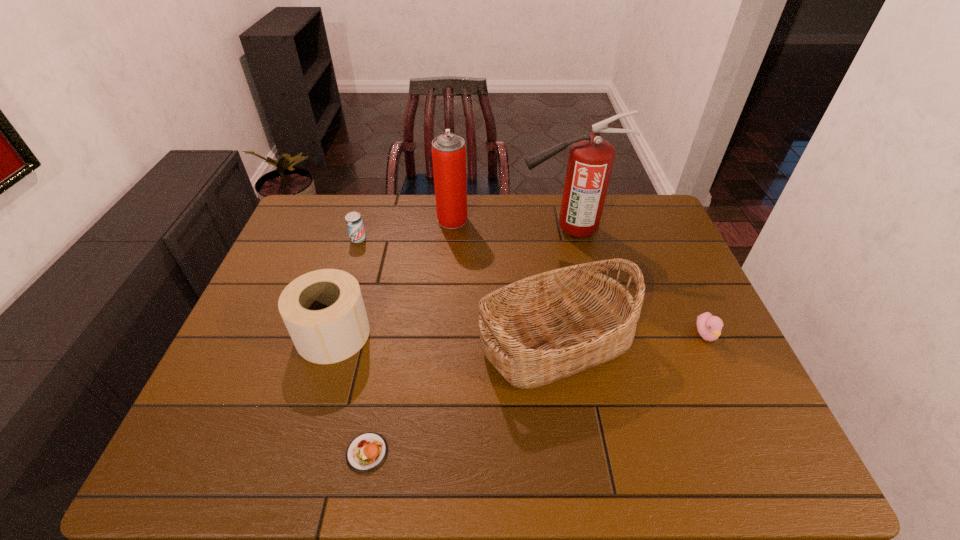
I want to click on fire extinguisher, so click(x=590, y=161).

In order to click on the fourth object from right to left in this screenshot , I will do `click(448, 150)`.

The image size is (960, 540). I want to click on the second tallest object, so click(448, 150).

Image resolution: width=960 pixels, height=540 pixels. I want to click on the fifth shortest object, so click(546, 327).

Where is `the fourth tallest object`? This screenshot has height=540, width=960. the fourth tallest object is located at coordinates (323, 310).

The width and height of the screenshot is (960, 540). I want to click on the third shortest object, so click(354, 222).

Image resolution: width=960 pixels, height=540 pixels. Identify the location of duckling. (709, 327).

At what (x,y) coordinates should I click in order to perform the action: click on the rightmost object. Please return your answer as a coordinate pair (x, y). This screenshot has height=540, width=960. Looking at the image, I should click on (709, 327).

I want to click on the third object from left to right, so click(366, 452).

At what (x,y) coordinates should I click in order to perform the action: click on the shortest object. Please return your answer as a coordinate pair (x, y). The width and height of the screenshot is (960, 540). Looking at the image, I should click on (366, 452).